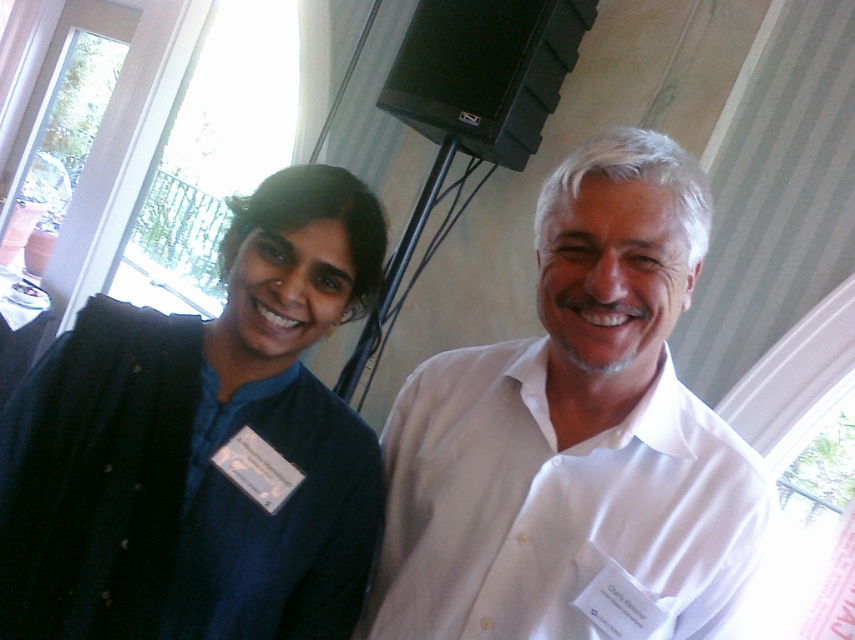
Can you confirm if white cotton shirt at center is positioned above velvet blue shirt at left?

Incorrect, white cotton shirt at center is not positioned above velvet blue shirt at left.

Is point (665, 326) positioned behind point (351, 278)?

No.

The height and width of the screenshot is (640, 855). I want to click on white cotton shirt at center, so click(575, 438).